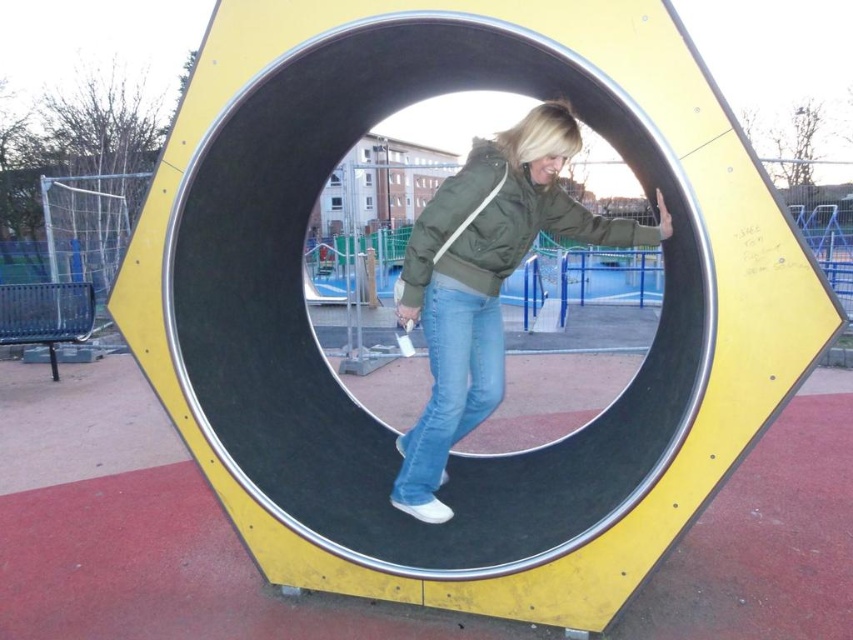
Is matte green jacket at center to the right of green matte jacket at center from the viewer's perspective?

In fact, matte green jacket at center is to the left of green matte jacket at center.

Is matte green jacket at center above green matte jacket at center?

No, matte green jacket at center is not above green matte jacket at center.

In order to click on matte green jacket at center in this screenshot , I will do `click(485, 280)`.